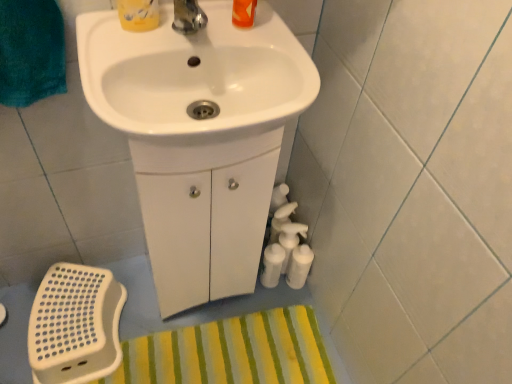
Find the location of a particular element. vacant area on top of white glossy sink at upper center, which ranks as the 1th sink in front-to-back order (from a real-world perspective) is located at coordinates (180, 34).